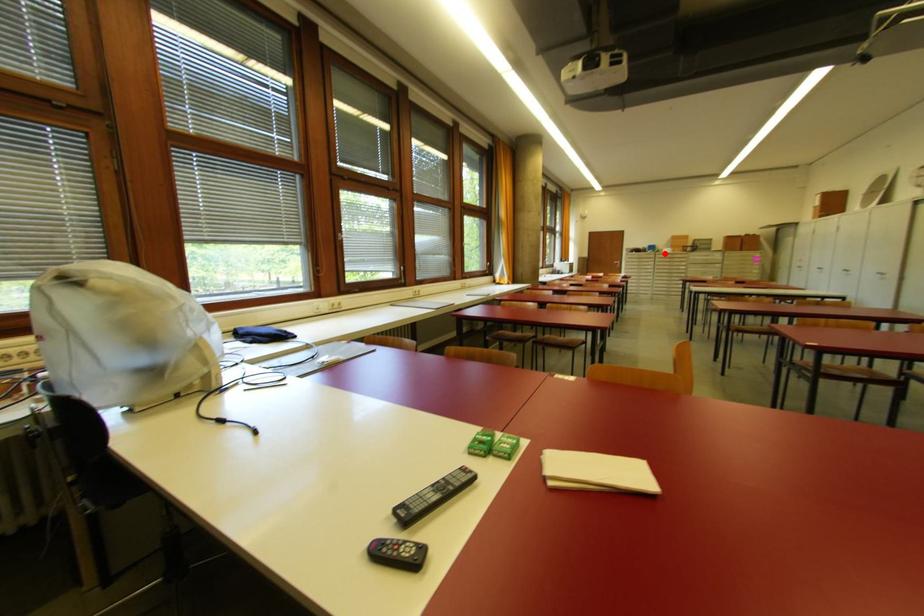
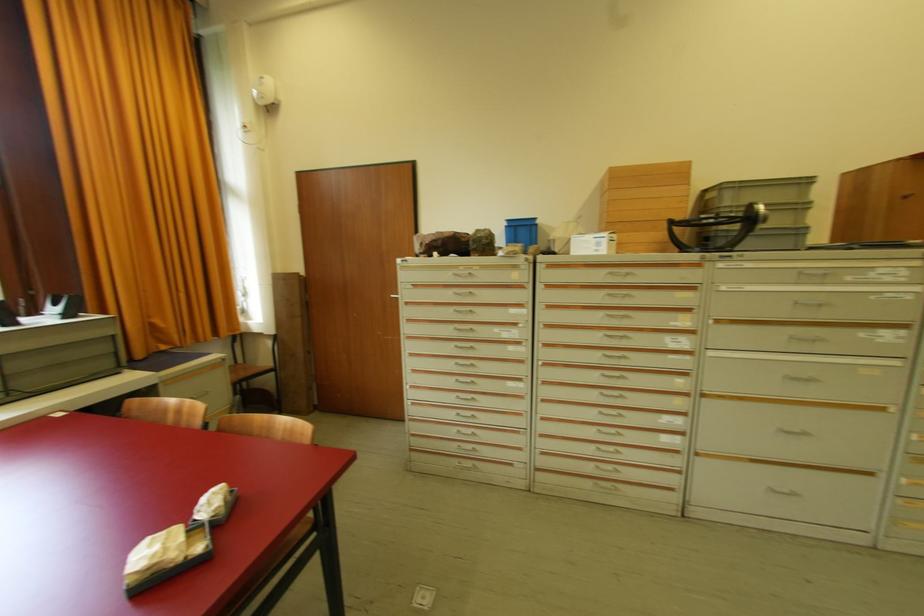
In the second image, find the point that corresponds to the highlighted location in the first image.

(570, 254)